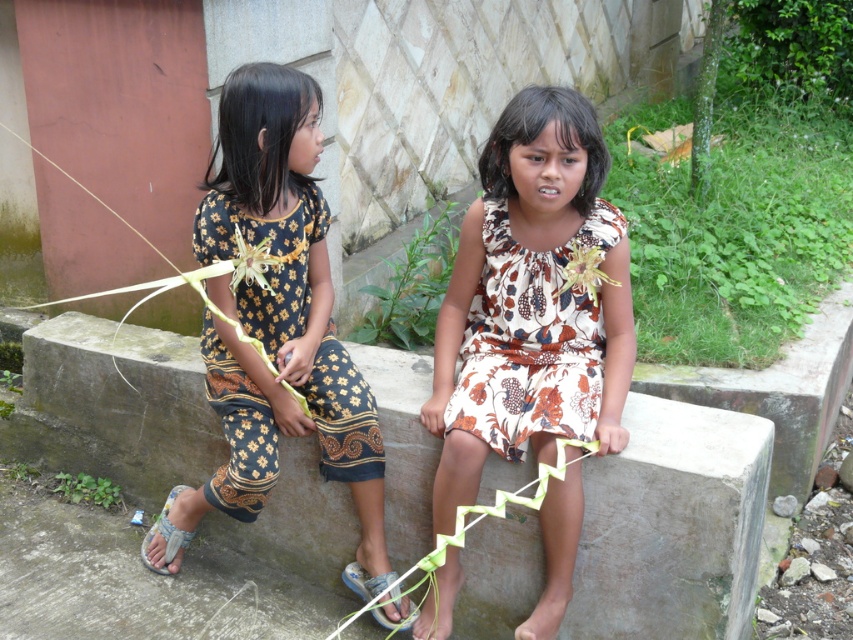
From the picture: You are a photographer setting up a shoot at the location shown. You want to place a small prop between the blue fabric sandal at lower center and the gray fabric sandal at lower left. The prop requires at least 24 inches of space to fit. Based on the scene, will there be enough space between the two sandals?

The blue fabric sandal at lower center and gray fabric sandal at lower left are 23.95 inches apart. Since the required space is 24 inches, there is not enough space to place the prop between them.

You are a photographer taking a picture of the two girls. You notice a specific point at coordinates point (364, 580). Based on the scene description, can you determine what object this point is located on?

The point (364, 580) is located on the blue fabric sandal at lower center.

You are a photographer trying to capture the two girls on the gray concrete at center and the printed fabric dress at center. Which object would you focus on first if you want to ensure the larger one is in sharp focus?

The gray concrete at center is larger than the printed fabric dress at center, so you should focus on the gray concrete at center first to ensure the larger object is in sharp focus.